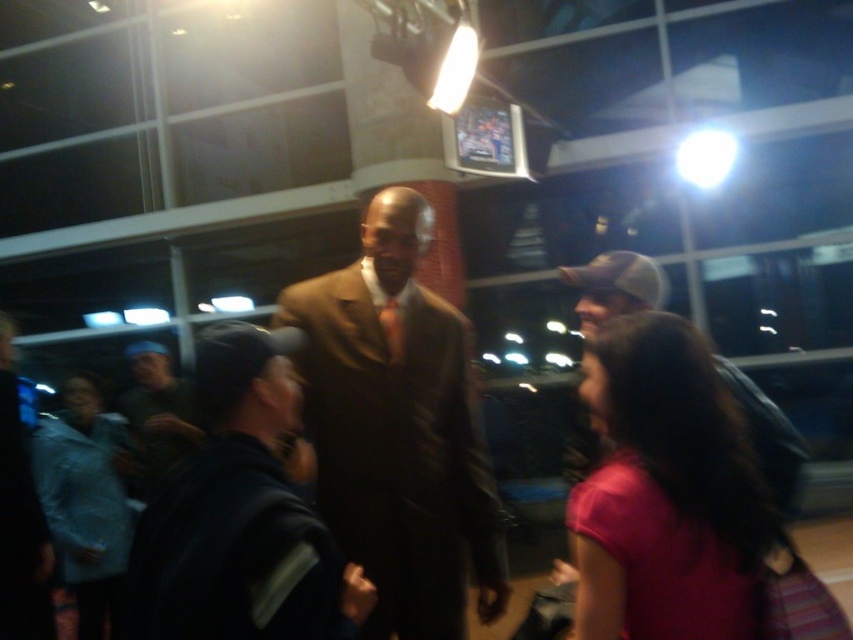
Which is behind, point (86, 486) or point (393, 342)?

Positioned behind is point (86, 486).

What do you see at coordinates (85, 502) in the screenshot?
I see `light blue fabric jacket at lower left` at bounding box center [85, 502].

Which is behind, point (39, 435) or point (402, 324)?

Point (39, 435)

You are a GUI agent. You are given a task and a screenshot of the screen. Output one action in this format:
    pyautogui.click(x=<x>, y=<y>)
    Task: Click on the light blue fabric jacket at lower left
    The image size is (853, 640).
    Given the screenshot: What is the action you would take?
    pyautogui.click(x=85, y=502)

Is point (698, 564) behind point (389, 340)?

No, it is in front of (389, 340).

Is point (669, 483) closer to camera compared to point (399, 340)?

Yes, point (669, 483) is in front of point (399, 340).

Identify the location of pink fabric shirt at center. coord(666,490).

The image size is (853, 640). Describe the element at coordinates (241, 515) in the screenshot. I see `dark brown suit at center` at that location.

Does dark brown suit at center appear over brown silk tie at center?

No.

Identify the location of dark brown suit at center. (241, 515).

Find the location of a particular element. This screenshot has height=640, width=853. dark brown suit at center is located at coordinates (241, 515).